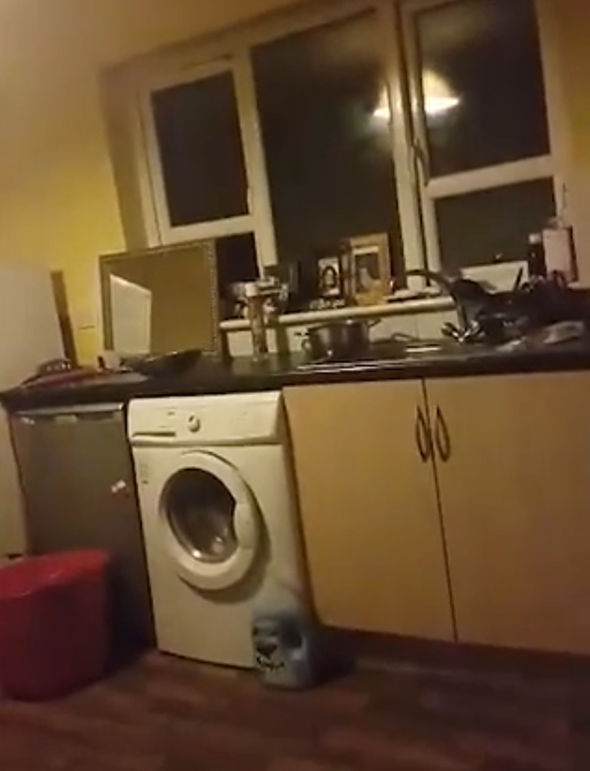
Locate an element on the screen. front loading washer is located at coordinates (217, 500).